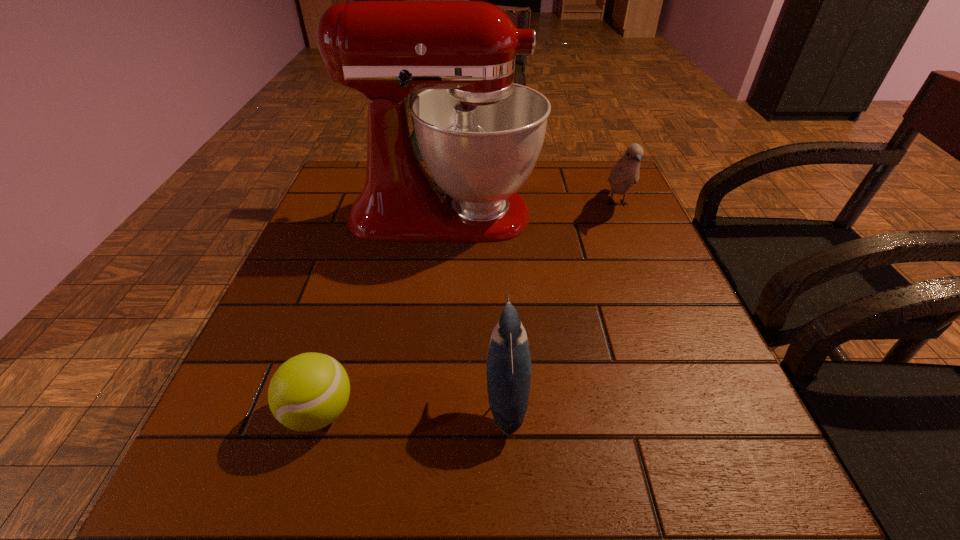
Locate an element on the screen. free spot located on the right of the shortest object is located at coordinates (479, 413).

Identify the location of mixer at the far edge. The width and height of the screenshot is (960, 540). (480, 134).

Where is `bird at the far edge`? The height and width of the screenshot is (540, 960). bird at the far edge is located at coordinates (625, 173).

You are a GUI agent. You are given a task and a screenshot of the screen. Output one action in this format:
    pyautogui.click(x=<x>, y=<y>)
    Task: Click on the mixer that is at the left edge
    This screenshot has width=960, height=540.
    Given the screenshot: What is the action you would take?
    pyautogui.click(x=480, y=134)

Where is `tennis ball that is at the left edge`? This screenshot has width=960, height=540. tennis ball that is at the left edge is located at coordinates 309,391.

Where is `object at the right edge`? object at the right edge is located at coordinates (625, 173).

You are a GUI agent. You are given a task and a screenshot of the screen. Output one action in this format:
    pyautogui.click(x=<x>, y=<y>)
    Task: Click on the object present at the far left corner
    
    Given the screenshot: What is the action you would take?
    pyautogui.click(x=480, y=134)

At what (x,y) coordinates should I click in order to perform the action: click on object that is at the far right corner. Please return your answer as a coordinate pair (x, y). The width and height of the screenshot is (960, 540). Looking at the image, I should click on (625, 173).

The height and width of the screenshot is (540, 960). I want to click on vacant space at the far edge, so click(x=544, y=183).

The height and width of the screenshot is (540, 960). I want to click on vacant region at the near edge, so click(523, 460).